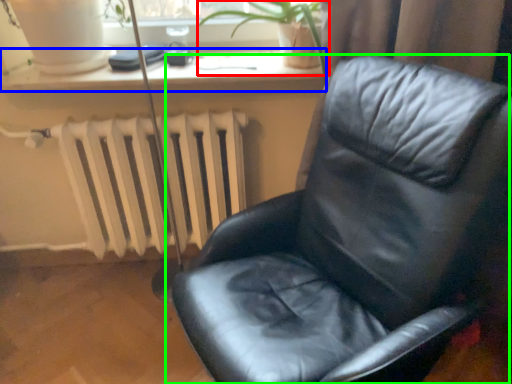
Question: Which is nearer to the plant (highlighted by a red box)? window sill (highlighted by a blue box) or chair (highlighted by a green box).

Choices:
 (A) window sill
 (B) chair

Answer: (A)